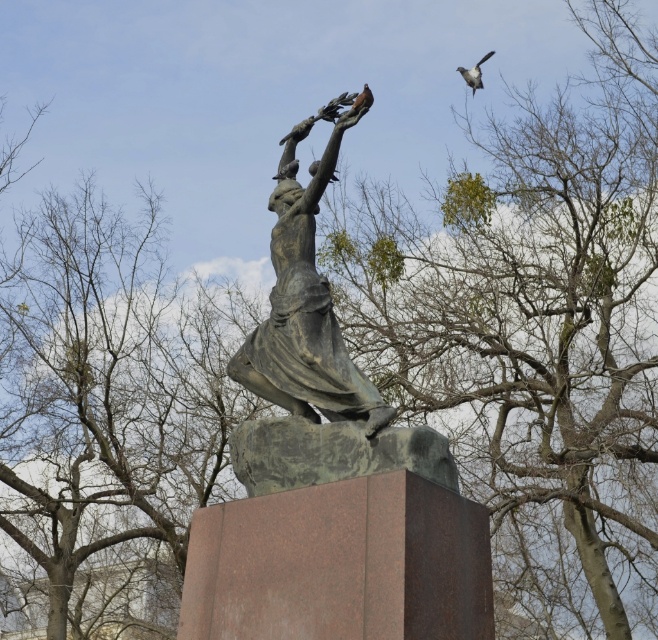
You are a photographer aiming to capture the bronze statue without any obstructions. You notice the bare branches at center and the gray feathered bird at upper right in your viewfinder. Which object should you adjust your angle to avoid?

The bare branches at center are in front of the gray feathered bird at upper right, so you should adjust your angle to avoid the bare branches at center obstructing the view of the statue.

You are a birdwatcher observing the scene from a distance. You notice a green mossy tree at upper center and a gray feathered bird at upper right. Which object is nearer to you?

The green mossy tree at upper center is closer to the viewer than the gray feathered bird at upper right.